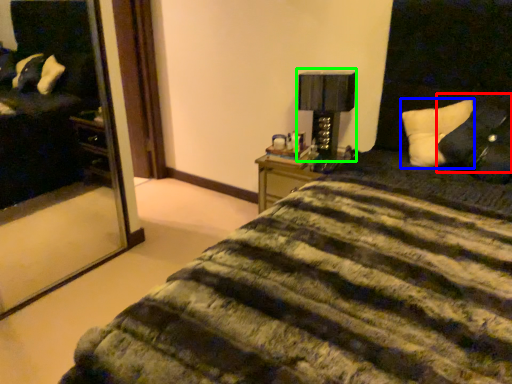
Question: Estimate the real-world distances between objects in this image. Which object is farther from pillow (highlighted by a red box), pillow (highlighted by a blue box) or table lamp (highlighted by a green box)?

Choices:
 (A) pillow
 (B) table lamp

Answer: (B)